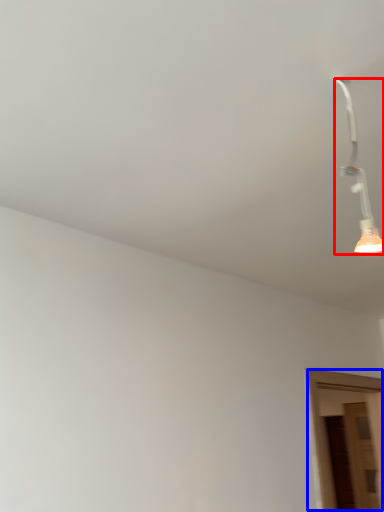
Question: Which object appears farthest to the camera in this image, lamp (highlighted by a red box) or door (highlighted by a blue box)?

Choices:
 (A) lamp
 (B) door

Answer: (B)